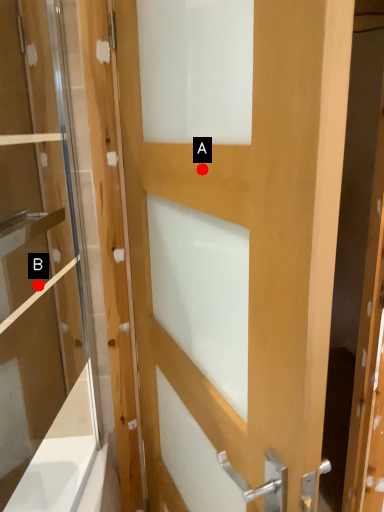
Question: Two points are circled on the image, labeled by A and B beside each circle. Which point is further to the camera?

Choices:
 (A) A is further
 (B) B is further

Answer: (B)